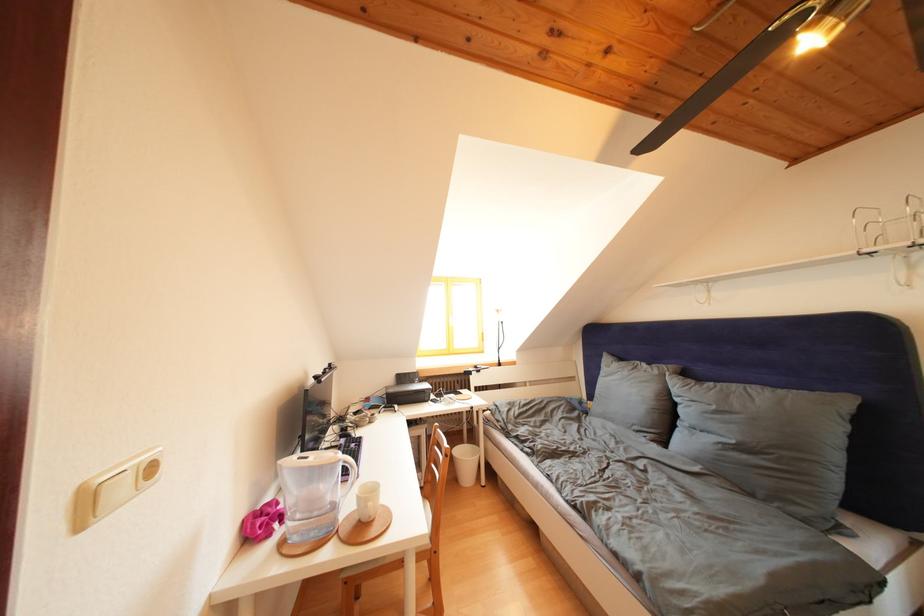
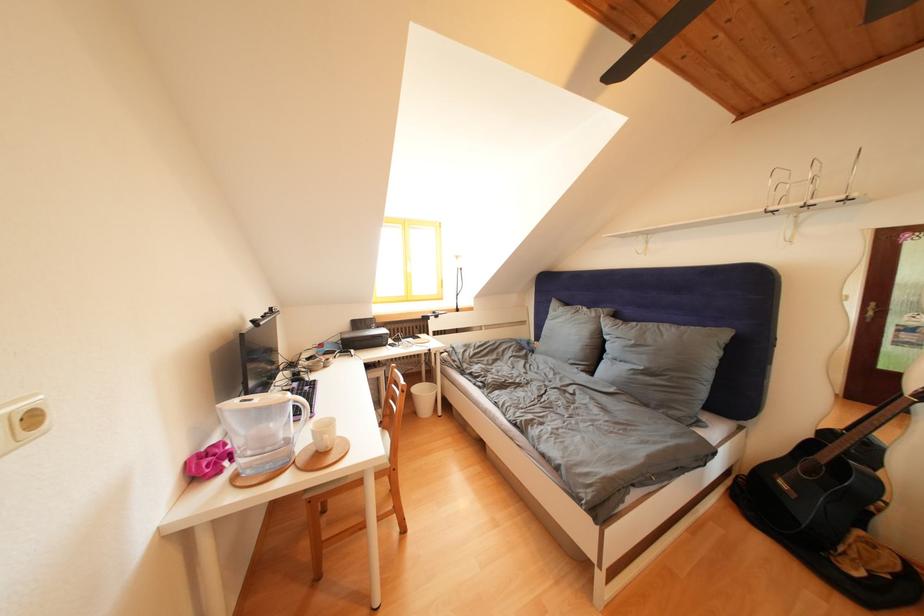
Where in the second image is the point corresponding to point (276, 503) from the first image?

(223, 446)